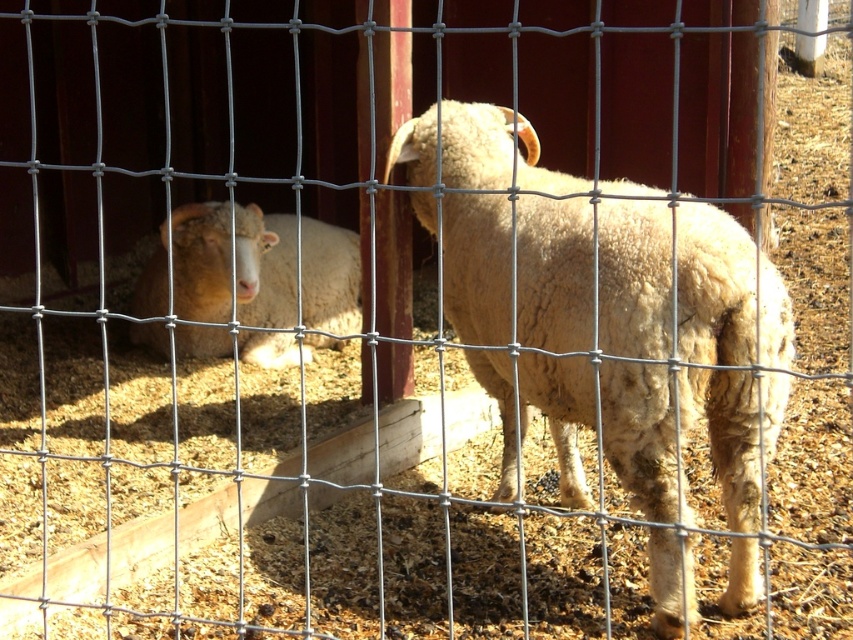
Question: Which point is closer to the camera?

Choices:
 (A) (654, 477)
 (B) (277, 280)

Answer: (A)

Question: Is light beige woolen sheep at center below fuzzy white sheep at left?

Choices:
 (A) no
 (B) yes

Answer: (B)

Question: Is the position of light beige woolen sheep at center less distant than that of fuzzy white sheep at left?

Choices:
 (A) yes
 (B) no

Answer: (A)

Question: Does light beige woolen sheep at center have a greater width compared to fuzzy white sheep at left?

Choices:
 (A) no
 (B) yes

Answer: (A)

Question: Which point is closer to the camera?

Choices:
 (A) light beige woolen sheep at center
 (B) fuzzy white sheep at left

Answer: (A)